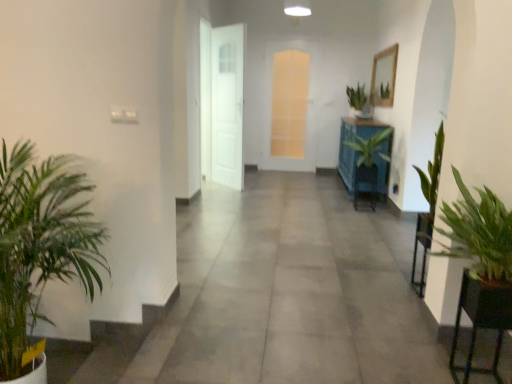
Question: Is green glossy plant at center, the 2th houseplant viewed from the right, not within translucent glass door at center, the 2th door when ordered from left to right?

Choices:
 (A) yes
 (B) no

Answer: (A)

Question: Does green glossy plant at center, the third houseplant in the left-to-right sequence, have a lesser height compared to translucent glass door at center, arranged as the 2th door when viewed from the front?

Choices:
 (A) yes
 (B) no

Answer: (A)

Question: Is green glossy plant at center, the 2th houseplant viewed from the right, further to camera compared to translucent glass door at center, arranged as the 2th door when viewed from the front?

Choices:
 (A) yes
 (B) no

Answer: (B)

Question: Is green glossy plant at center, the 2th houseplant viewed from the right, to the left of translucent glass door at center, positioned as the 1th door in right-to-left order, from the viewer's perspective?

Choices:
 (A) yes
 (B) no

Answer: (B)

Question: Is green glossy plant at center, marked as the 3th houseplant in a front-to-back arrangement, smaller than translucent glass door at center, positioned as the 1th door in right-to-left order?

Choices:
 (A) yes
 (B) no

Answer: (B)

Question: Considering the relative positions of green glossy plant at center, the third houseplant in the left-to-right sequence, and translucent glass door at center, positioned as the 1th door in right-to-left order, in the image provided, is green glossy plant at center, the third houseplant in the left-to-right sequence, in front of translucent glass door at center, positioned as the 1th door in right-to-left order,?

Choices:
 (A) yes
 (B) no

Answer: (A)

Question: From the image's perspective, is green leafy plant at right, the 3th houseplant in the right-to-left sequence, located above translucent glass door at center, the 2th door when ordered from left to right?

Choices:
 (A) yes
 (B) no

Answer: (B)

Question: Is green leafy plant at right, the 3th houseplant in the right-to-left sequence, further to the viewer compared to translucent glass door at center, positioned as the 1th door in right-to-left order?

Choices:
 (A) yes
 (B) no

Answer: (B)

Question: From a real-world perspective, is green leafy plant at right, which is counted as the second houseplant, starting from the front, positioned under translucent glass door at center, positioned as the 1th door in right-to-left order, based on gravity?

Choices:
 (A) no
 (B) yes

Answer: (B)

Question: Is green leafy plant at right, marked as the 3th houseplant in a back-to-front arrangement, thinner than translucent glass door at center, positioned as the 1th door in right-to-left order?

Choices:
 (A) no
 (B) yes

Answer: (A)

Question: Can you confirm if green leafy plant at right, the 3th houseplant in the right-to-left sequence, is taller than translucent glass door at center, the 2th door when ordered from left to right?

Choices:
 (A) yes
 (B) no

Answer: (B)

Question: From the image's perspective, is green leafy plant at right, marked as the 3th houseplant in a back-to-front arrangement, under translucent glass door at center, arranged as the 2th door when viewed from the front?

Choices:
 (A) yes
 (B) no

Answer: (A)

Question: From the image's perspective, would you say green leafy plant at left, the 4th houseplant in the right-to-left sequence, is shown under green glossy plant at center, the third houseplant in the left-to-right sequence?

Choices:
 (A) yes
 (B) no

Answer: (A)